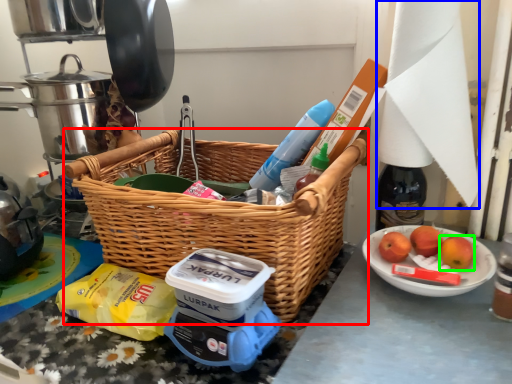
Question: Which object is the farthest from picnic basket (highlighted by a red box)? Choose among these: paper towel (highlighted by a blue box) or apple (highlighted by a green box).

Choices:
 (A) paper towel
 (B) apple

Answer: (B)